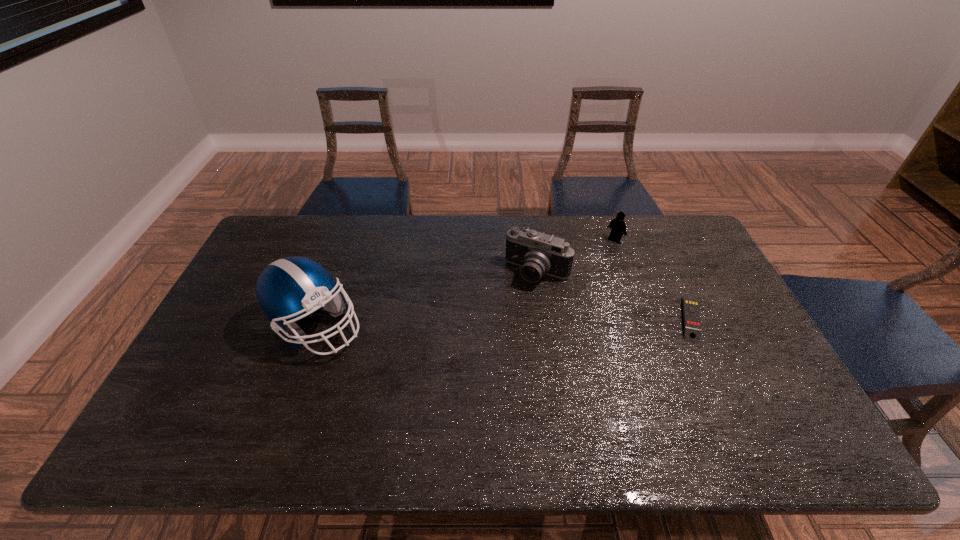
Identify the location of the tallest object. This screenshot has height=540, width=960. (289, 287).

Where is `football helmet`? The image size is (960, 540). football helmet is located at coordinates (289, 287).

The height and width of the screenshot is (540, 960). What are the coordinates of `the shortest object` in the screenshot? It's located at (692, 326).

In order to click on the rightmost object in this screenshot , I will do `click(692, 326)`.

Find the location of a particular element. The image size is (960, 540). Lego is located at coordinates (617, 225).

What are the coordinates of `the second shortest object` in the screenshot? It's located at (617, 225).

Locate an element on the screen. The height and width of the screenshot is (540, 960). the third shortest object is located at coordinates (537, 253).

You are a GUI agent. You are given a task and a screenshot of the screen. Output one action in this format:
    pyautogui.click(x=<x>, y=<y>)
    Task: Click on the third nearest object
    The width and height of the screenshot is (960, 540).
    Given the screenshot: What is the action you would take?
    pyautogui.click(x=537, y=253)

At what (x,y) coordinates should I click in order to perform the action: click on vacant area situated at the front of the tallest object with the faceguard. Please return your answer as a coordinate pair (x, y). Looking at the image, I should click on (480, 326).

At what (x,y) coordinates should I click in order to perform the action: click on vacant region located 0.100m on the right of the rightmost object. Please return your answer as a coordinate pair (x, y). Looking at the image, I should click on (739, 319).